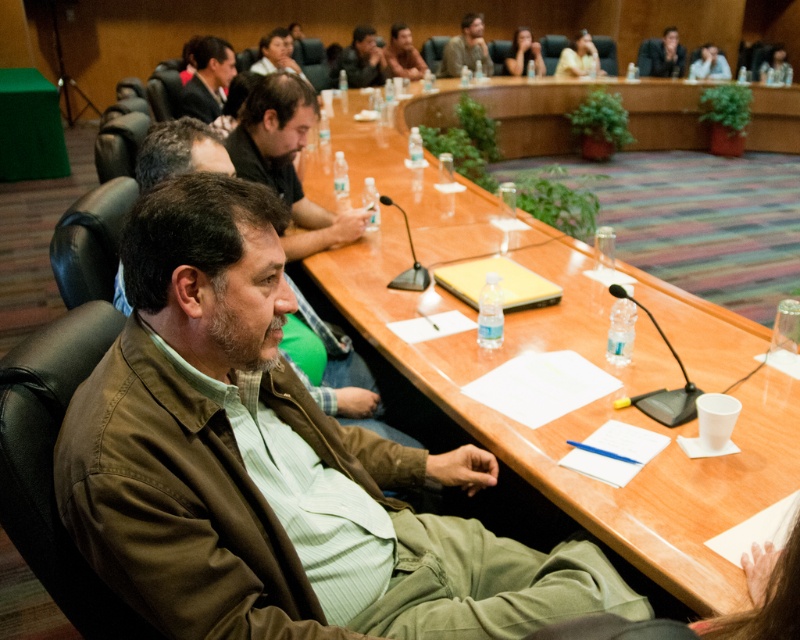
Question: Considering the real-world distances, which object is farthest from the matte black suit at upper left?

Choices:
 (A) brown leather jacket at upper center
 (B) brown leather jacket at center
 (C) matte black laptop at upper right
 (D) brown fabric jacket at center

Answer: (C)

Question: Does brown fabric jacket at center appear over matte black suit at upper left?

Choices:
 (A) no
 (B) yes

Answer: (A)

Question: Does matte black camera at upper center have a smaller size compared to brown leather jacket at upper center?

Choices:
 (A) no
 (B) yes

Answer: (B)

Question: Can you confirm if matte black suit at upper left is positioned above matte black laptop at upper right?

Choices:
 (A) no
 (B) yes

Answer: (A)

Question: Which object is closer to the camera taking this photo?

Choices:
 (A) brown leather jacket at center
 (B) matte black suit at upper left
 (C) brown fabric jacket at center
 (D) brown leather jacket at upper center

Answer: (C)

Question: Which object is positioned farthest from the brown fabric jacket at center?

Choices:
 (A) light beige shirt at upper center
 (B) brown leather jacket at upper center
 (C) brown leather jacket at center

Answer: (A)